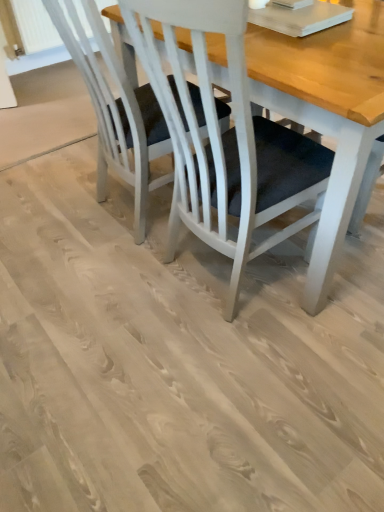
At what (x,y) coordinates should I click in order to perform the action: click on vacant region below white painted wood chair at center (from a real-world perspective). Please return your answer as a coordinate pair (x, y). This screenshot has height=512, width=384. Looking at the image, I should click on (147, 220).